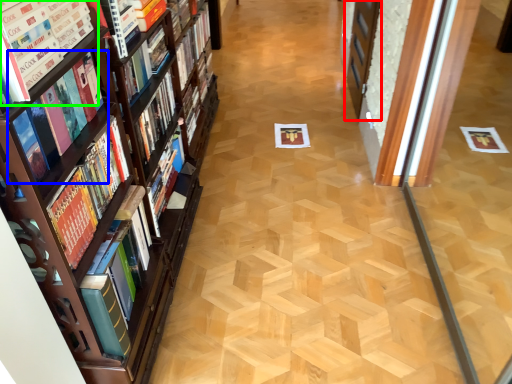
Question: Based on their relative distances, which object is nearer to screen door (highlighted by a red box)? Choose from book (highlighted by a blue box) and book (highlighted by a green box).

Choices:
 (A) book
 (B) book

Answer: (A)